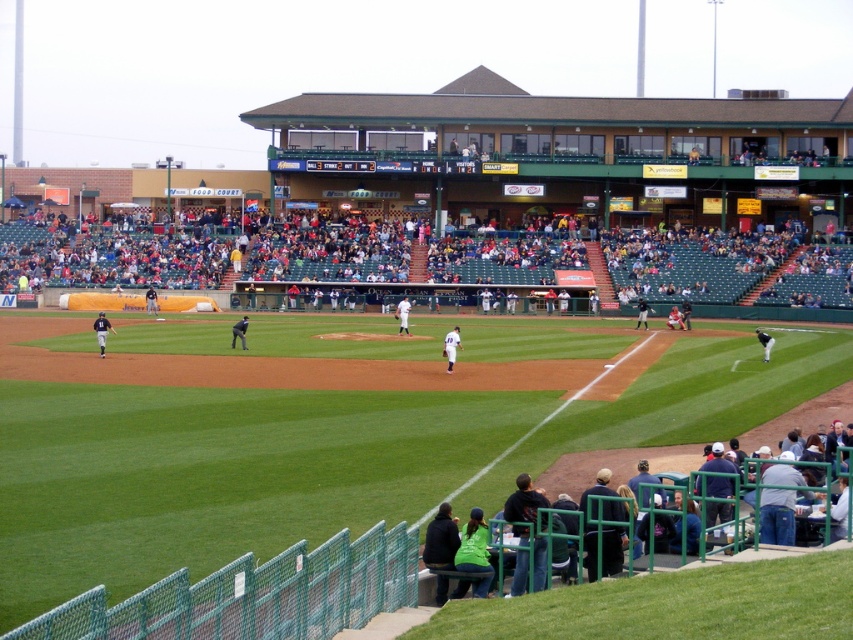
You are a photographer standing at the edge of the field. You want to take a photo that includes both the white jersey baseball players at lower right and the orange jersey at center. Which of the two groups is positioned closer to you?

The white jersey baseball players at lower right are closer to the viewer than the orange jersey at center, so they will appear closer in the photo.

You are a photographer at the baseball game and want to capture both the black uniform at center and the dark blue uniform at center in a single shot. Considering their sizes, which uniform will appear smaller in the photo?

The black uniform at center will appear smaller in the photo because it has a smaller size compared to the dark blue uniform at center.

Based on the photo, you are a spectator sitting at the center of the stadium and want to watch the white jersey baseball players at lower right. Which direction should you turn your head to look at them?

The white jersey baseball players at lower right are located at point (614, 465), which is to your right side. So you should turn your head to the right to look at them.